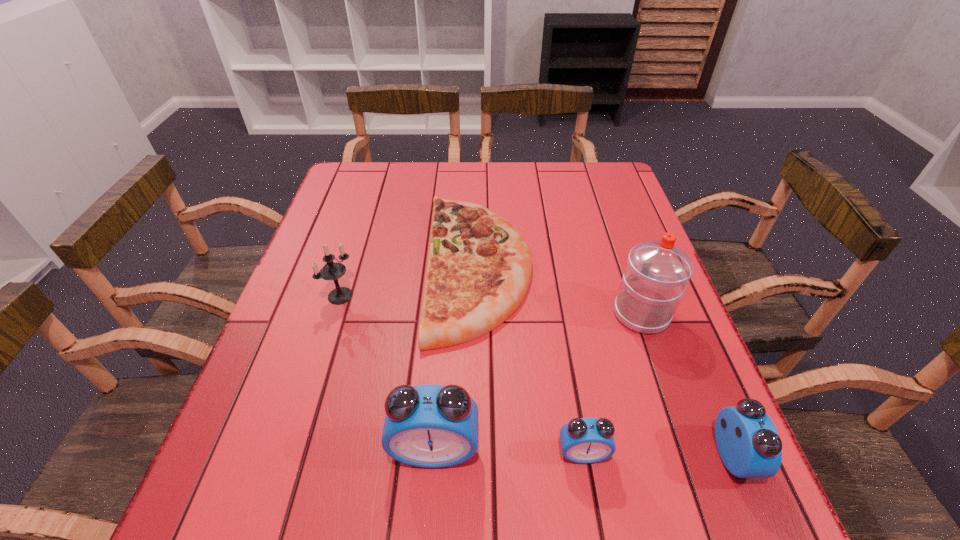
This screenshot has width=960, height=540. Identify the location of empty space that is in between the candle holder and the second alarm clock from right to left. (462, 374).

Where is `free space that is in between the leftmost alarm clock and the third object from right to left`? This screenshot has height=540, width=960. free space that is in between the leftmost alarm clock and the third object from right to left is located at coordinates (509, 451).

The width and height of the screenshot is (960, 540). What are the coordinates of `free spot between the tallest object and the shortest alarm clock` in the screenshot? It's located at (612, 383).

Choose which object is the second nearest neighbor to the leftmost alarm clock. Please provide its 2D coordinates. Your answer should be formatted as a tuple, i.e. [(x, y)], where the tuple contains the x and y coordinates of a point satisfying the conditions above.

[(479, 269)]

Select which object appears as the fifth closest to the fourth tallest object. Please provide its 2D coordinates. Your answer should be formatted as a tuple, i.e. [(x, y)], where the tuple contains the x and y coordinates of a point satisfying the conditions above.

[(332, 270)]

At what (x,y) coordinates should I click in order to perform the action: click on alarm clock object that ranks as the closest to the water bottle. Please return your answer as a coordinate pair (x, y). The image size is (960, 540). Looking at the image, I should click on (747, 440).

Where is `alarm clock that stands as the closest to the rightmost alarm clock`? This screenshot has width=960, height=540. alarm clock that stands as the closest to the rightmost alarm clock is located at coordinates (583, 440).